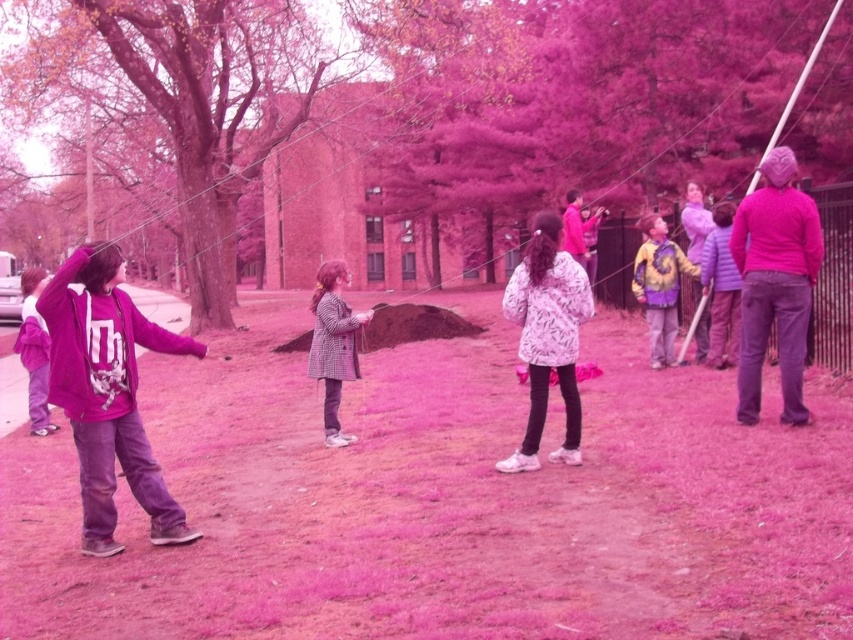
Who is higher up, brown soil at center or purple matte hoodie at left?

Positioned higher is purple matte hoodie at left.

Does point (383, 524) come farther from viewer compared to point (77, 301)?

Yes, point (383, 524) is behind point (77, 301).

Is point (172, 580) positioned after point (106, 420)?

That is False.

The image size is (853, 640). What are the coordinates of `brown soil at center` in the screenshot? It's located at (445, 502).

Can you confirm if smooth bark tree at center is positioned above yellow tie-dye shirt at center?

Correct, smooth bark tree at center is located above yellow tie-dye shirt at center.

Is smooth bark tree at center bigger than yellow tie-dye shirt at center?

Yes.

This screenshot has width=853, height=640. Describe the element at coordinates (189, 99) in the screenshot. I see `smooth bark tree at center` at that location.

At what (x,y) coordinates should I click in order to perform the action: click on smooth bark tree at center. Please return your answer as a coordinate pair (x, y). The height and width of the screenshot is (640, 853). Looking at the image, I should click on (189, 99).

Is yellow tie-dye shirt at center bigger than purple fleece jacket at left?

Actually, yellow tie-dye shirt at center might be smaller than purple fleece jacket at left.

Which is in front, point (674, 248) or point (53, 432)?

Point (53, 432) is in front.

Locate an element on the screen. The height and width of the screenshot is (640, 853). yellow tie-dye shirt at center is located at coordinates (659, 285).